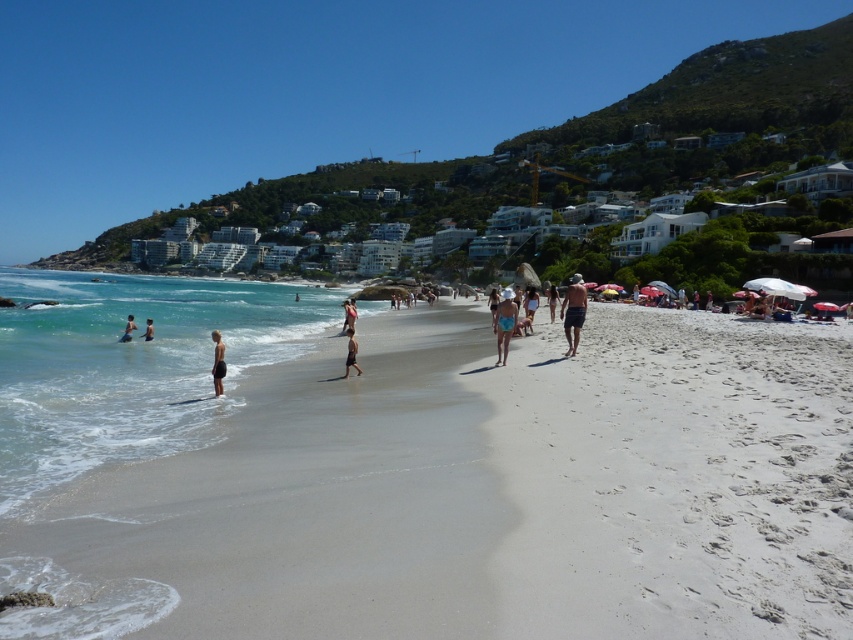
Question: Which object is the farthest from the light brown skin at left?

Choices:
 (A) tan fabric shorts at center
 (B) clear water at beach left
 (C) light blue swimwear at left
 (D) blue fabric bikini at center

Answer: (B)

Question: Which of the following is the closest to the observer?

Choices:
 (A) (125, 332)
 (B) (503, 420)
 (C) (221, 344)

Answer: (B)

Question: Is light brown skin at left positioned at the back of light blue swimwear at left?

Choices:
 (A) no
 (B) yes

Answer: (A)

Question: Where is clear water at beach left located in relation to tan fabric shorts at center in the image?

Choices:
 (A) right
 (B) left

Answer: (B)

Question: Does white sand beach at center have a smaller size compared to dark gray shorts at center?

Choices:
 (A) yes
 (B) no

Answer: (B)

Question: Which object is positioned closest to the light brown skin at left?

Choices:
 (A) matte black shorts at center
 (B) blue fabric bikini at center
 (C) tan fabric shorts at center
 (D) dark gray shorts at center

Answer: (A)